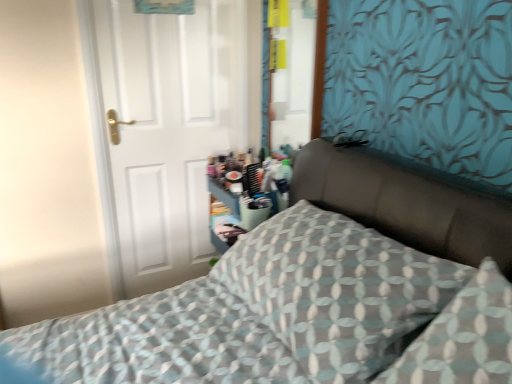
The image size is (512, 384). What do you see at coordinates (337, 290) in the screenshot?
I see `patterned fabric pillow at center` at bounding box center [337, 290].

What do you see at coordinates (167, 132) in the screenshot? I see `white matte door at left` at bounding box center [167, 132].

Where is `patterned fabric pillow at center`? The width and height of the screenshot is (512, 384). patterned fabric pillow at center is located at coordinates (337, 290).

Would you say patterned fabric bed at center is outside white matte door at left?

Yes, patterned fabric bed at center is outside of white matte door at left.

In the scene shown: Are patterned fabric bed at center and white matte door at left far apart?

No, there isn't a large distance between patterned fabric bed at center and white matte door at left.

From the image's perspective, between patterned fabric bed at center and white matte door at left, which one is located above?

From the image's view, white matte door at left is above.

Choose the correct answer: Is patterned fabric pillow at center inside patterned fabric bed at center or outside it?

patterned fabric pillow at center is located inside patterned fabric bed at center.

Could you tell me if patterned fabric pillow at center is turned towards patterned fabric bed at center?

Yes, patterned fabric pillow at center is turned towards patterned fabric bed at center.

Is patterned fabric pillow at center not close to patterned fabric bed at center?

That's not correct — patterned fabric pillow at center is a little close to patterned fabric bed at center.

Who is bigger, patterned fabric pillow at center or patterned fabric bed at center?

patterned fabric bed at center is bigger.

From a real-world perspective, which object rests below the other?

In real-world perspective, patterned fabric bed at center is lower.

Is the position of white matte door at left more distant than that of patterned fabric bed at center?

Yes, the depth of white matte door at left is greater than that of patterned fabric bed at center.

Can you tell me how much white matte door at left and patterned fabric bed at center differ in facing direction?

The facing directions of white matte door at left and patterned fabric bed at center are 88 degrees apart.

Is white matte door at left positioned with its back to patterned fabric bed at center?

That's not correct — white matte door at left is not looking away from patterned fabric bed at center.

Does white matte door at left have a smaller size compared to patterned fabric pillow at center?

Indeed, white matte door at left has a smaller size compared to patterned fabric pillow at center.

Considering the relative positions of white matte door at left and patterned fabric pillow at center in the image provided, is white matte door at left behind patterned fabric pillow at center?

Yes, white matte door at left is further from the viewer.

Considering the sizes of objects white matte door at left and patterned fabric pillow at center in the image provided, who is thinner, white matte door at left or patterned fabric pillow at center?

Thinner between the two is white matte door at left.

Is white matte door at left turned away from patterned fabric pillow at center?

No, white matte door at left's orientation is not away from patterned fabric pillow at center.

Consider the image. Which object is thinner, patterned fabric pillow at center or white matte door at left?

white matte door at left.

Which is behind, point (255, 269) or point (226, 3)?

Point (226, 3)

How distant is patterned fabric pillow at center from white matte door at left?

patterned fabric pillow at center is 3.69 feet away from white matte door at left.

In the scene shown: Does patterned fabric pillow at center contain white matte door at left?

No.

Does patterned fabric bed at center have a larger size compared to patterned fabric pillow at center?

Correct, patterned fabric bed at center is larger in size than patterned fabric pillow at center.

Is patterned fabric pillow at center located within patterned fabric bed at center?

Yes, patterned fabric bed at center contains patterned fabric pillow at center.

Is patterned fabric bed at center facing away from patterned fabric pillow at center?

patterned fabric bed at center does not have its back to patterned fabric pillow at center.

Does patterned fabric bed at center touch patterned fabric pillow at center?

Yes, the surface of patterned fabric bed at center is in contact with patterned fabric pillow at center.

Where is `bed below the white matte door at left (from a real-world perspective)`? The width and height of the screenshot is (512, 384). bed below the white matte door at left (from a real-world perspective) is located at coordinates (314, 295).

I want to click on pillow located behind the patterned fabric bed at center, so click(337, 290).

From the picture: Estimate the real-world distances between objects in this image. Which object is further from patterned fabric pillow at center, white matte door at left or patterned fabric bed at center?

The object further to patterned fabric pillow at center is white matte door at left.

From the image, which object appears to be farther from patterned fabric bed at center, white matte door at left or patterned fabric pillow at center?

white matte door at left.

From the image, which object appears to be nearer to patterned fabric pillow at center, patterned fabric bed at center or white matte door at left?

patterned fabric bed at center is closer to patterned fabric pillow at center.

Based on their spatial positions, is patterned fabric bed at center or patterned fabric pillow at center further from white matte door at left?

patterned fabric pillow at center is positioned further to the anchor white matte door at left.

Based on their spatial positions, is patterned fabric pillow at center or patterned fabric bed at center further from white matte door at left?

Based on the image, patterned fabric pillow at center appears to be further to white matte door at left.

Estimate the real-world distances between objects in this image. Which object is further from patterned fabric bed at center, patterned fabric pillow at center or white matte door at left?

white matte door at left lies further to patterned fabric bed at center than the other object.

Find the location of a particular element. Image resolution: width=512 pixels, height=384 pixels. pillow between patterned fabric bed at center and white matte door at left from front to back is located at coordinates (337, 290).